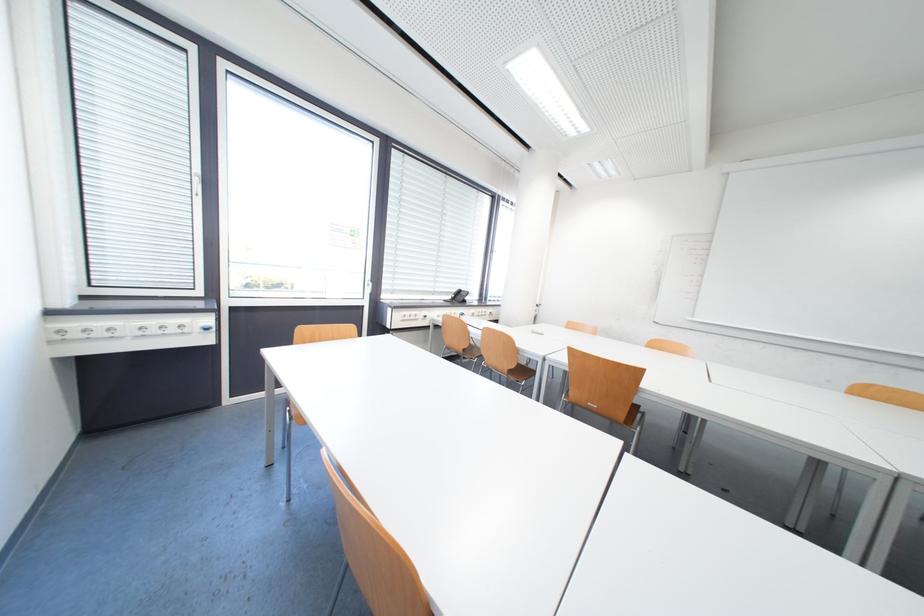
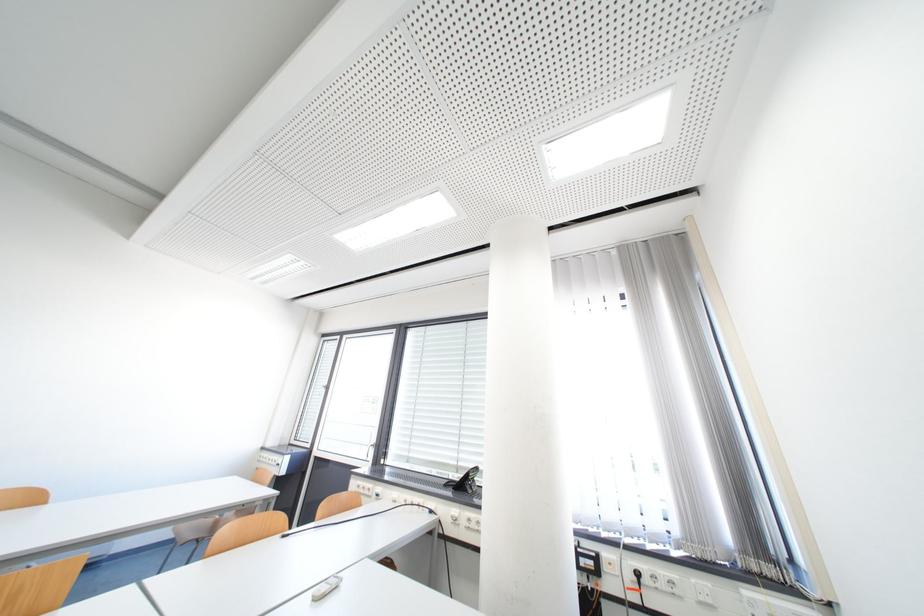
Find the pixel in the second image that matches point 463,300 in the first image.

(478, 483)